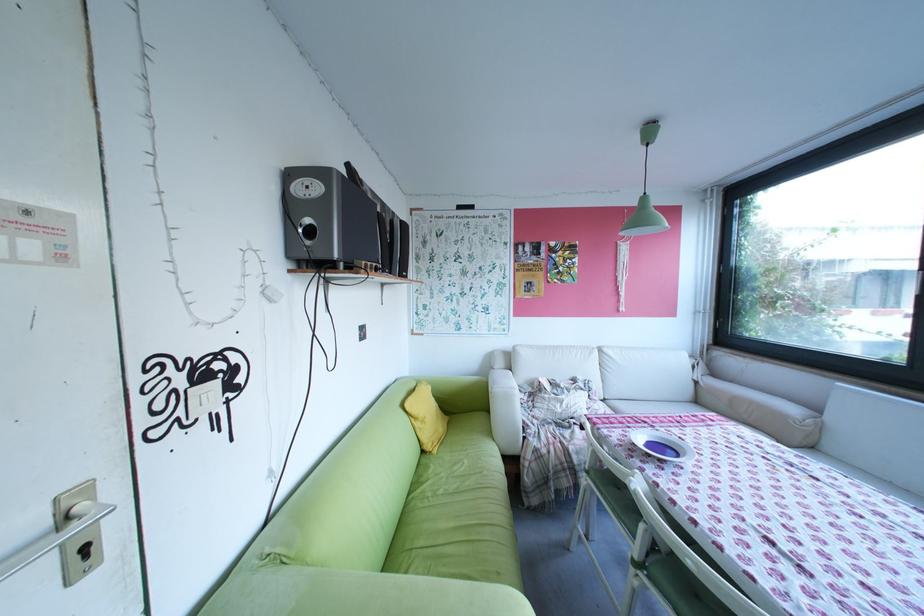
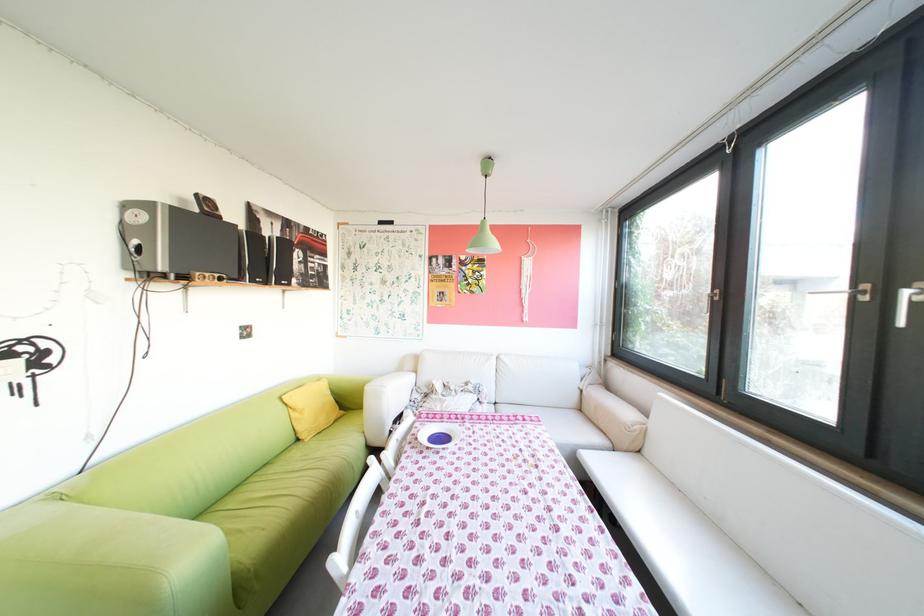
Find the pixel in the second image that matches pixel 429 419 in the first image.

(307, 410)